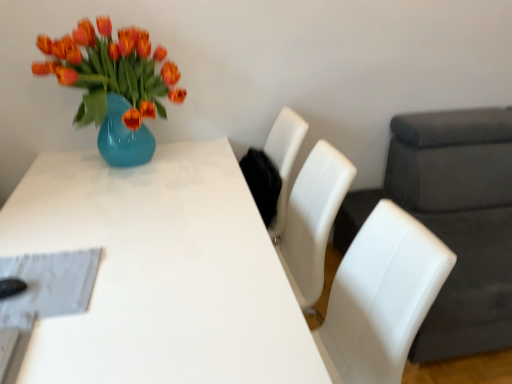
Question: Considering the relative positions of white glossy table at center and white leather swivel chair at right in the image provided, is white glossy table at center behind white leather swivel chair at right?

Choices:
 (A) no
 (B) yes

Answer: (A)

Question: From a real-world perspective, is white glossy table at center on top of white leather swivel chair at right?

Choices:
 (A) no
 (B) yes

Answer: (A)

Question: Is white glossy table at center turned away from white leather swivel chair at right?

Choices:
 (A) yes
 (B) no

Answer: (B)

Question: Could you tell me if white glossy table at center is turned towards white leather swivel chair at right?

Choices:
 (A) yes
 (B) no

Answer: (B)

Question: Considering the relative positions of white glossy table at center and white leather swivel chair at right in the image provided, is white glossy table at center to the left of white leather swivel chair at right from the viewer's perspective?

Choices:
 (A) no
 (B) yes

Answer: (B)

Question: Considering the relative sizes of white glossy table at center and white leather swivel chair at right in the image provided, is white glossy table at center wider than white leather swivel chair at right?

Choices:
 (A) yes
 (B) no

Answer: (A)

Question: Is white glossy table at center completely or partially inside white leather swivel chair at right?

Choices:
 (A) no
 (B) yes

Answer: (A)

Question: Does white leather swivel chair at right touch white glossy table at center?

Choices:
 (A) no
 (B) yes

Answer: (A)

Question: Can you confirm if white leather swivel chair at right is positioned to the left of white glossy table at center?

Choices:
 (A) yes
 (B) no

Answer: (B)

Question: Is white leather swivel chair at right outside white glossy table at center?

Choices:
 (A) yes
 (B) no

Answer: (A)

Question: From a real-world perspective, is white leather swivel chair at right beneath white glossy table at center?

Choices:
 (A) no
 (B) yes

Answer: (A)

Question: Is white leather swivel chair at right oriented towards white glossy table at center?

Choices:
 (A) no
 (B) yes

Answer: (B)

Question: In terms of width, does white leather swivel chair at right look wider or thinner when compared to white glossy table at center?

Choices:
 (A) wide
 (B) thin

Answer: (B)